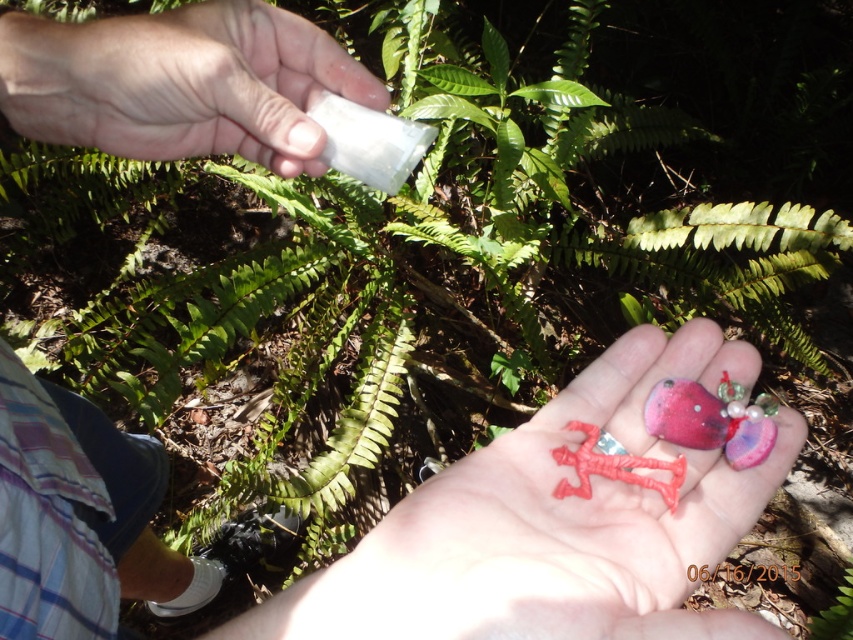
Looking at this image, is matte plastic toy at center to the left of rubber man at center from the viewer's perspective?

Yes, matte plastic toy at center is to the left of rubber man at center.

Image resolution: width=853 pixels, height=640 pixels. What are the coordinates of `matte plastic toy at center` in the screenshot? It's located at pyautogui.click(x=553, y=525).

Is white matte paper at upper left positioned behind rubber man at center?

No, it is in front of rubber man at center.

Can you confirm if white matte paper at upper left is positioned to the right of rubber man at center?

Incorrect, white matte paper at upper left is not on the right side of rubber man at center.

Image resolution: width=853 pixels, height=640 pixels. What do you see at coordinates (178, 83) in the screenshot?
I see `white matte paper at upper left` at bounding box center [178, 83].

The height and width of the screenshot is (640, 853). What are the coordinates of `white matte paper at upper left` in the screenshot? It's located at (178, 83).

Does matte plastic toy at center appear on the left side of white matte paper at upper left?

No, matte plastic toy at center is not to the left of white matte paper at upper left.

The height and width of the screenshot is (640, 853). What do you see at coordinates (553, 525) in the screenshot? I see `matte plastic toy at center` at bounding box center [553, 525].

Between point (502, 488) and point (235, 29), which one is positioned in front?

Point (502, 488)

This screenshot has width=853, height=640. I want to click on matte plastic toy at center, so click(x=553, y=525).